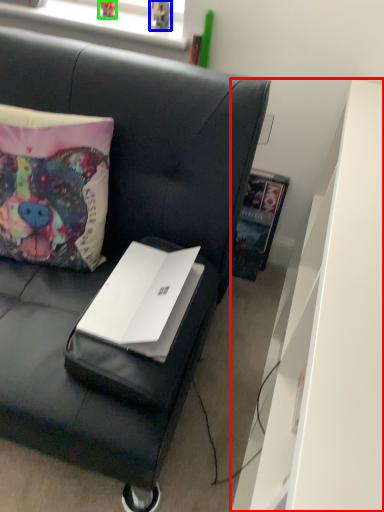
Question: Considering the real-world distances, which object is closest to dresser (highlighted by a red box)? toy (highlighted by a blue box) or toy (highlighted by a green box).

Choices:
 (A) toy
 (B) toy

Answer: (A)